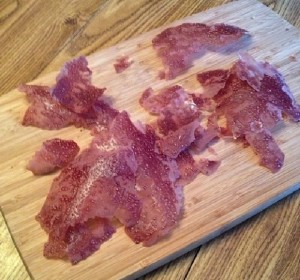
What are the coordinates of `wooden cutting board on wooden countertop` in the screenshot? It's located at (199, 208), (215, 251).